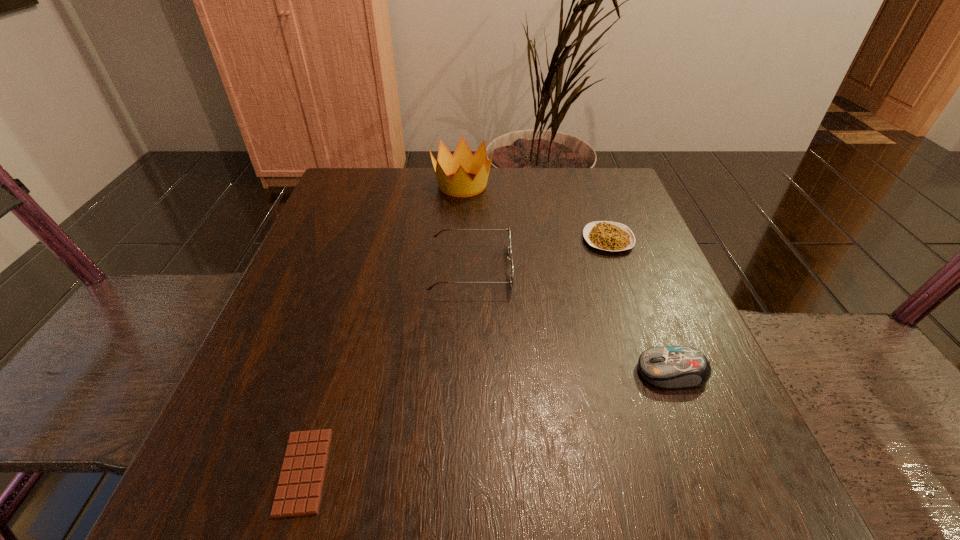
Locate an element on the screen. object that is at the near left corner is located at coordinates (298, 493).

The image size is (960, 540). I want to click on vacant area at the far edge, so click(401, 191).

The image size is (960, 540). I want to click on free space at the near edge, so click(405, 505).

In the image, there is a desktop. Where is `vacant space at the left edge`? vacant space at the left edge is located at coordinates (297, 328).

Image resolution: width=960 pixels, height=540 pixels. Find the location of `vacant area at the right edge of the desktop`. vacant area at the right edge of the desktop is located at coordinates (690, 446).

What are the coordinates of `vacant area at the far left corner` in the screenshot? It's located at point(388,173).

Locate an element on the screen. The width and height of the screenshot is (960, 540). vacant space at the near left corner is located at coordinates (209, 503).

This screenshot has height=540, width=960. In the image, there is a desktop. Identify the location of vacant space at the far right corner. (621, 193).

Identify the location of unoccupied position between the computer mouse and the second shortest object. (640, 306).

This screenshot has width=960, height=540. What are the coordinates of `vacant point located between the sunglasses and the fourth farthest object` in the screenshot? It's located at (571, 320).